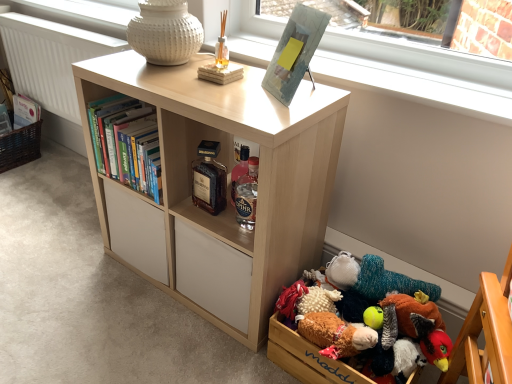
In order to face white textured radiator at lower left, should I rotate leftwards or rightwards?

Turn left approximately 23.745 degrees to face it.

Image resolution: width=512 pixels, height=384 pixels. Identify the location of wooden plush toys at lower right. (310, 357).

The height and width of the screenshot is (384, 512). I want to click on light wood bookcase at center, so click(228, 167).

This screenshot has height=384, width=512. Describe the element at coordinates (127, 143) in the screenshot. I see `hardcover books at left` at that location.

I want to click on translucent glass bottle at center, which ranks as the second bottle in left-to-right order, so click(x=247, y=194).

The image size is (512, 384). I want to click on white textured radiator at lower left, so click(x=50, y=59).

Does brown glass bottle at center, which ranks as the 1th bottle in left-to-right order, contain wooden plush toys at lower right?

Actually, wooden plush toys at lower right is outside brown glass bottle at center, which ranks as the 1th bottle in left-to-right order.

Considering the sizes of brown glass bottle at center, which is counted as the 2th bottle, starting from the right, and wooden plush toys at lower right in the image, is brown glass bottle at center, which is counted as the 2th bottle, starting from the right, wider or thinner than wooden plush toys at lower right?

Clearly, brown glass bottle at center, which is counted as the 2th bottle, starting from the right, has less width compared to wooden plush toys at lower right.

Between brown glass bottle at center, which is counted as the 2th bottle, starting from the right, and wooden plush toys at lower right, which one appears on the left side from the viewer's perspective?

From the viewer's perspective, brown glass bottle at center, which is counted as the 2th bottle, starting from the right, appears more on the left side.

Is point (47, 24) more distant than point (404, 331)?

Yes.

From a real-world perspective, is white textured radiator at lower left under fluffy multicolored stuffed animal at lower right, which is the second toy from back to front?

No, from a real-world perspective, white textured radiator at lower left is not below fluffy multicolored stuffed animal at lower right, which is the second toy from back to front.

How distant is white textured radiator at lower left from fluffy multicolored stuffed animal at lower right, which is the second toy from back to front?

white textured radiator at lower left is 6.08 feet away from fluffy multicolored stuffed animal at lower right, which is the second toy from back to front.

In the image, is brown glass bottle at center, which is counted as the 2th bottle, starting from the right, positioned in front of or behind fluffy multicolored stuffed animal at lower right, which is counted as the 2th toy, starting from the front?

Visually, brown glass bottle at center, which is counted as the 2th bottle, starting from the right, is located behind fluffy multicolored stuffed animal at lower right, which is counted as the 2th toy, starting from the front.

Would you say brown glass bottle at center, which ranks as the 1th bottle in left-to-right order, is inside or outside fluffy multicolored stuffed animal at lower right, which is counted as the 2th toy, starting from the front?

brown glass bottle at center, which ranks as the 1th bottle in left-to-right order, lies outside fluffy multicolored stuffed animal at lower right, which is counted as the 2th toy, starting from the front.

Is brown glass bottle at center, which ranks as the 1th bottle in left-to-right order, surrounded by wooden plush toys at lower right?

That's incorrect, brown glass bottle at center, which ranks as the 1th bottle in left-to-right order, is not inside wooden plush toys at lower right.

Are wooden plush toys at lower right and brown glass bottle at center, which is counted as the 2th bottle, starting from the right, far apart?

wooden plush toys at lower right is actually quite close to brown glass bottle at center, which is counted as the 2th bottle, starting from the right.

Can you confirm if wooden plush toys at lower right is taller than brown glass bottle at center, which is counted as the 2th bottle, starting from the right?

No, wooden plush toys at lower right is not taller than brown glass bottle at center, which is counted as the 2th bottle, starting from the right.

Is wooden plush toys at lower right facing away from brown glass bottle at center, which is counted as the 2th bottle, starting from the right?

No, wooden plush toys at lower right is not facing the opposite direction of brown glass bottle at center, which is counted as the 2th bottle, starting from the right.

Based on the photo, is fluffy multicolored stuffed toys at lower right, placed as the third toy when sorted from back to front, next to wooden plush toys at lower right?

Absolutely, fluffy multicolored stuffed toys at lower right, placed as the third toy when sorted from back to front, is next to and touching wooden plush toys at lower right.

Is fluffy multicolored stuffed toys at lower right, the first toy viewed from the front, located outside wooden plush toys at lower right?

fluffy multicolored stuffed toys at lower right, the first toy viewed from the front, lies outside wooden plush toys at lower right's area.

From the image's perspective, relative to wooden plush toys at lower right, is fluffy multicolored stuffed toys at lower right, the first toy viewed from the front, above or below?

Clearly, from the image's perspective, fluffy multicolored stuffed toys at lower right, the first toy viewed from the front, is below wooden plush toys at lower right.

How many degrees apart are the facing directions of fluffy multicolored stuffed toys at lower right, the first toy viewed from the front, and wooden plush toys at lower right?

The facing directions of fluffy multicolored stuffed toys at lower right, the first toy viewed from the front, and wooden plush toys at lower right are 0.798 degrees apart.

From a real-world perspective, between fluffy multicolored stuffed toys at lower right, the first toy viewed from the front, and hardcover books at left, who is vertically higher?

hardcover books at left is physically above.

Does fluffy multicolored stuffed toys at lower right, the first toy viewed from the front, turn towards hardcover books at left?

No.

Locate an element on the screen. The width and height of the screenshot is (512, 384). book that appears above the fluffy multicolored stuffed toys at lower right, the first toy viewed from the front (from the image's perspective) is located at coordinates (127, 143).

Is hardcover books at left smaller than fluffy multicolored stuffed animal at lower right, which is the second toy from back to front?

Actually, hardcover books at left might be larger than fluffy multicolored stuffed animal at lower right, which is the second toy from back to front.

Is hardcover books at left positioned with its back to fluffy multicolored stuffed animal at lower right, which is the second toy from back to front?

No, hardcover books at left is not facing away from fluffy multicolored stuffed animal at lower right, which is the second toy from back to front.

Does hardcover books at left have a lesser width compared to fluffy multicolored stuffed animal at lower right, which is the second toy from back to front?

Incorrect, the width of hardcover books at left is not less than that of fluffy multicolored stuffed animal at lower right, which is the second toy from back to front.

Would you consider hardcover books at left to be distant from fluffy multicolored stuffed animal at lower right, which is the second toy from back to front?

That's not correct — hardcover books at left is a little close to fluffy multicolored stuffed animal at lower right, which is the second toy from back to front.

Where is `storage box in front of the brown glass bottle at center, which is counted as the 2th bottle, starting from the right`? The height and width of the screenshot is (384, 512). storage box in front of the brown glass bottle at center, which is counted as the 2th bottle, starting from the right is located at coordinates (310, 357).

At what (x,y) coordinates should I click in order to perform the action: click on radiator to the left of fluffy multicolored stuffed animal at lower right, which is the second toy from back to front. Please return your answer as a coordinate pair (x, y). Image resolution: width=512 pixels, height=384 pixels. Looking at the image, I should click on (50, 59).

From the image, which object appears to be farther from light wood bookcase at center, translucent glass bottle at center, the first bottle from the right, or hardcover books at left?

The object further to light wood bookcase at center is translucent glass bottle at center, the first bottle from the right.

From the image, which object appears to be nearer to wooden plush toys at lower right, fluffy multicolored stuffed toys at lower right, placed as the third toy when sorted from back to front, or translucent glass bottle at center, the first bottle from the right?

Based on the image, fluffy multicolored stuffed toys at lower right, placed as the third toy when sorted from back to front, appears to be nearer to wooden plush toys at lower right.

Looking at the image, which one is located further to translucent glass bottle at center, which ranks as the second bottle in left-to-right order, fluffy multicolored stuffed toys at lower right, the first toy viewed from the front, or wooden plush toys at lower right?

fluffy multicolored stuffed toys at lower right, the first toy viewed from the front, is positioned further to the anchor translucent glass bottle at center, which ranks as the second bottle in left-to-right order.

Based on their spatial positions, is light wood bookcase at center or fluffy multicolored stuffed toys at lower right, placed as the third toy when sorted from back to front, further from brown glass bottle at center, which is counted as the 2th bottle, starting from the right?

fluffy multicolored stuffed toys at lower right, placed as the third toy when sorted from back to front, is positioned further to the anchor brown glass bottle at center, which is counted as the 2th bottle, starting from the right.

Consider the image. Based on their spatial positions, is light wood bookcase at center or fluffy multicolored stuffed animal at lower right, which is counted as the 2th toy, starting from the front, closer to knitted plush toy at lower right, the 1th toy viewed from the back?

Among the two, fluffy multicolored stuffed animal at lower right, which is counted as the 2th toy, starting from the front, is located nearer to knitted plush toy at lower right, the 1th toy viewed from the back.

From the image, which object appears to be farther from hardcover books at left, white textured radiator at lower left or brown glass bottle at center, which is counted as the 2th bottle, starting from the right?

white textured radiator at lower left is further to hardcover books at left.

Consider the image. Looking at the image, which one is located further to light wood bookcase at center, wooden plush toys at lower right or knitted plush toy at lower right, the 1th toy viewed from the back?

knitted plush toy at lower right, the 1th toy viewed from the back.

Looking at the image, which one is located further to translucent glass bottle at center, the first bottle from the right, fluffy multicolored stuffed animal at lower right, which is the second toy from back to front, or hardcover books at left?

fluffy multicolored stuffed animal at lower right, which is the second toy from back to front, is further to translucent glass bottle at center, the first bottle from the right.

The height and width of the screenshot is (384, 512). I want to click on toy between white textured radiator at lower left and fluffy multicolored stuffed toys at lower right, placed as the third toy when sorted from back to front, so click(387, 281).

The height and width of the screenshot is (384, 512). Find the location of `bottle between light wood bookcase at center and wooden plush toys at lower right in the vertical direction`. bottle between light wood bookcase at center and wooden plush toys at lower right in the vertical direction is located at coordinates 247,194.

This screenshot has width=512, height=384. I want to click on toy between brown glass bottle at center, which ranks as the 1th bottle in left-to-right order, and fluffy multicolored stuffed toys at lower right, the first toy viewed from the front, so click(x=387, y=281).

Locate an element on the screen. This screenshot has width=512, height=384. storage box located between brown glass bottle at center, which is counted as the 2th bottle, starting from the right, and fluffy multicolored stuffed animal at lower right, which is counted as the 2th toy, starting from the front, in the left-right direction is located at coordinates (310, 357).